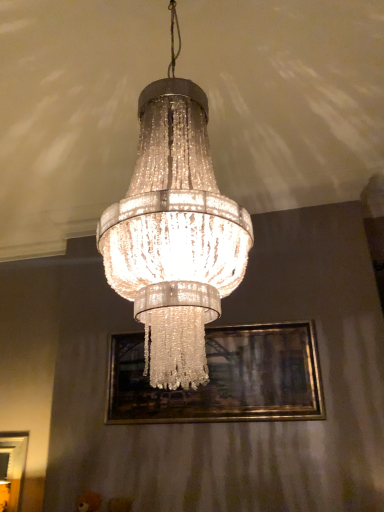
Question: Does gold metallic picture frame at center come behind clear crystal chandelier at center?

Choices:
 (A) yes
 (B) no

Answer: (A)

Question: Can you confirm if gold metallic picture frame at center is bigger than clear crystal chandelier at center?

Choices:
 (A) no
 (B) yes

Answer: (A)

Question: Is gold metallic picture frame at center far away from clear crystal chandelier at center?

Choices:
 (A) no
 (B) yes

Answer: (B)

Question: Does gold metallic picture frame at center appear on the right side of clear crystal chandelier at center?

Choices:
 (A) yes
 (B) no

Answer: (A)

Question: Is gold metallic picture frame at center thinner than clear crystal chandelier at center?

Choices:
 (A) no
 (B) yes

Answer: (B)

Question: Is gold metallic picture frame at center to the left of clear crystal chandelier at center from the viewer's perspective?

Choices:
 (A) no
 (B) yes

Answer: (A)

Question: Is clear crystal chandelier at center looking in the opposite direction of gold metallic picture frame at center?

Choices:
 (A) yes
 (B) no

Answer: (A)

Question: Is clear crystal chandelier at center thinner than gold metallic picture frame at center?

Choices:
 (A) yes
 (B) no

Answer: (B)

Question: From the image's perspective, is clear crystal chandelier at center under gold metallic picture frame at center?

Choices:
 (A) yes
 (B) no

Answer: (B)

Question: Can you confirm if clear crystal chandelier at center is positioned to the left of gold metallic picture frame at center?

Choices:
 (A) yes
 (B) no

Answer: (A)

Question: Is gold metallic picture frame at center a part of clear crystal chandelier at center?

Choices:
 (A) no
 (B) yes

Answer: (A)

Question: Considering the relative positions of clear crystal chandelier at center and gold metallic picture frame at center in the image provided, is clear crystal chandelier at center to the right of gold metallic picture frame at center from the viewer's perspective?

Choices:
 (A) no
 (B) yes

Answer: (A)

Question: Which is correct: gold metallic picture frame at center is inside clear crystal chandelier at center, or outside of it?

Choices:
 (A) outside
 (B) inside

Answer: (A)